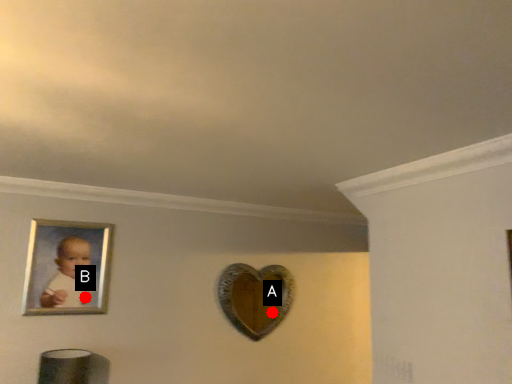
Question: Two points are circled on the image, labeled by A and B beside each circle. Which point is closer to the camera?

Choices:
 (A) A is closer
 (B) B is closer

Answer: (B)